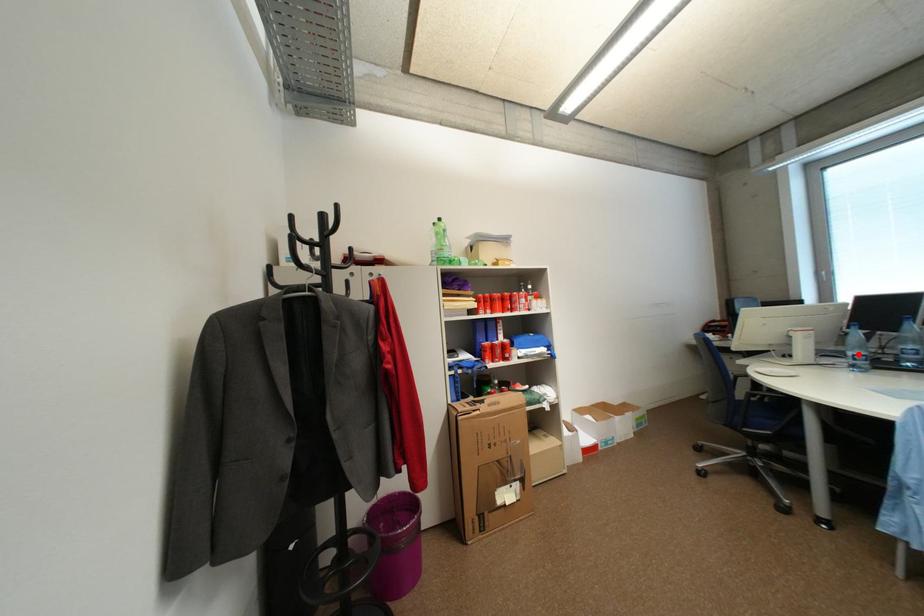
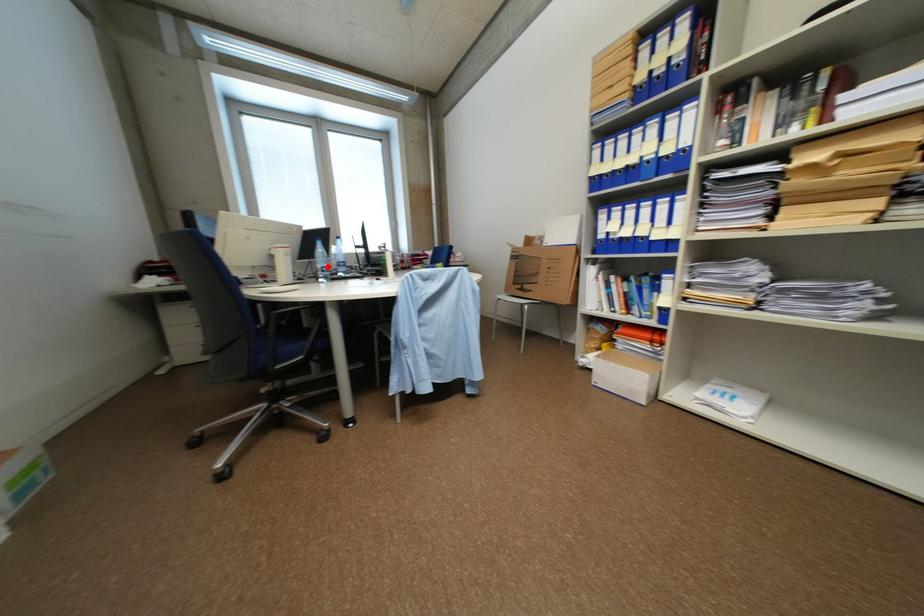
From the picture: I am providing you with two images of the same scene from different viewpoints. A red point is marked on the first image and another point is marked on the second image. Is the marked point in image1 the same physical position as the marked point in image2?

Yes